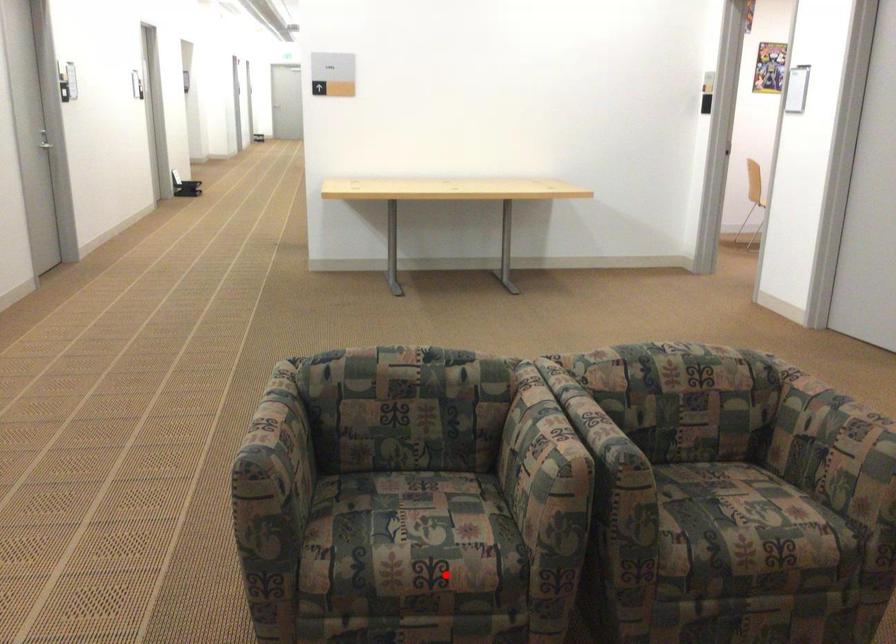
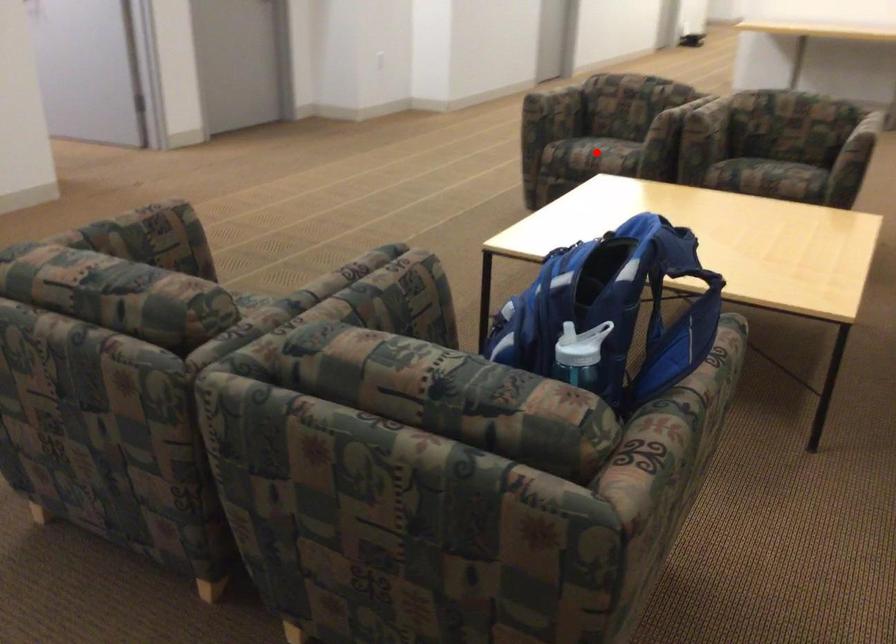
I am providing you with two images of the same scene from different viewpoints. A red point is marked on the first image and another point is marked on the second image. Are the points marked in image1 and image2 representing the same 3D position?

Yes